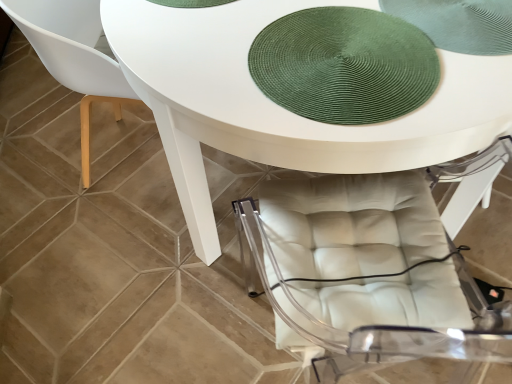
Find the location of a particular element. Image resolution: width=512 pixels, height=384 pixels. space that is in front of matte white chair at lower left is located at coordinates (96, 286).